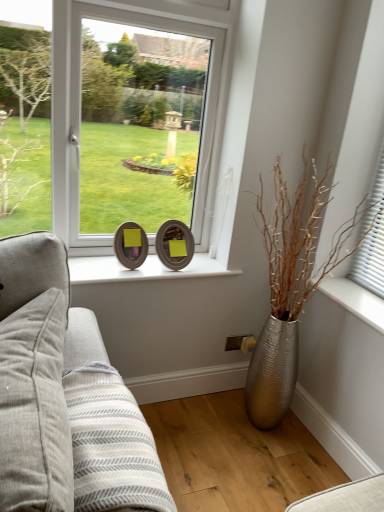
What do you see at coordinates (355, 300) in the screenshot?
I see `silver metallic vase at right` at bounding box center [355, 300].

This screenshot has width=384, height=512. What do you see at coordinates (35, 409) in the screenshot? I see `gray fabric pillow at left` at bounding box center [35, 409].

Describe the element at coordinates (174, 244) in the screenshot. I see `wooden frame at center, which is counted as the first picture frame, starting from the right` at that location.

Where is `silver metallic vase at right`? Image resolution: width=384 pixels, height=512 pixels. silver metallic vase at right is located at coordinates (355, 300).

Is silver metallic vase at right surrounding silver metallic vase at right?

No, silver metallic vase at right is not a part of silver metallic vase at right.

Which object is further away from the camera taking this photo, silver metallic vase at right or silver metallic vase at right?

Positioned behind is silver metallic vase at right.

Which object is positioned more to the left, silver metallic vase at right or silver metallic vase at right?

silver metallic vase at right.

Does point (382, 302) lie behind point (297, 223)?

Yes, it is behind point (297, 223).

From a real-world perspective, is silver metallic vase at right above or below wooden frame at center, which is counted as the first picture frame, starting from the right?

silver metallic vase at right is situated lower than wooden frame at center, which is counted as the first picture frame, starting from the right, in the real world.

From the image's perspective, would you say silver metallic vase at right is positioned over wooden frame at center, which is counted as the first picture frame, starting from the right?

No, from the image's perspective, silver metallic vase at right is not on top of wooden frame at center, which is counted as the first picture frame, starting from the right.

Is silver metallic vase at right bigger or smaller than wooden frame at center, which ranks as the second picture frame in left-to-right order?

silver metallic vase at right is bigger than wooden frame at center, which ranks as the second picture frame in left-to-right order.

Does silver metallic vase at right appear on the right side of silver metallic vase at right?

Incorrect, silver metallic vase at right is not on the right side of silver metallic vase at right.

Is silver metallic vase at right inside silver metallic vase at right?

That's correct, silver metallic vase at right is inside silver metallic vase at right.

From the image's perspective, would you say silver metallic vase at right is positioned over wooden oval frame at center, arranged as the second picture frame when viewed from the right?

No.

From a real-world perspective, is silver metallic vase at right positioned above or below wooden oval frame at center, placed as the 1th picture frame when sorted from left to right?

From a real-world perspective, silver metallic vase at right is physically below wooden oval frame at center, placed as the 1th picture frame when sorted from left to right.

Do you think silver metallic vase at right is within wooden oval frame at center, arranged as the second picture frame when viewed from the right, or outside of it?

silver metallic vase at right lies outside wooden oval frame at center, arranged as the second picture frame when viewed from the right.

Considering the sizes of wooden oval frame at center, placed as the 1th picture frame when sorted from left to right, and silver metallic vase at right in the image, is wooden oval frame at center, placed as the 1th picture frame when sorted from left to right, wider or thinner than silver metallic vase at right?

wooden oval frame at center, placed as the 1th picture frame when sorted from left to right, is thinner than silver metallic vase at right.

Based on the photo, is wooden oval frame at center, placed as the 1th picture frame when sorted from left to right, aimed at silver metallic vase at right?

No, wooden oval frame at center, placed as the 1th picture frame when sorted from left to right, is not turned towards silver metallic vase at right.

Is wooden oval frame at center, placed as the 1th picture frame when sorted from left to right, placed right next to silver metallic vase at right?

No, wooden oval frame at center, placed as the 1th picture frame when sorted from left to right, is not touching silver metallic vase at right.

Find the location of `window sill above the gray fabric pillow at left (from the image's perspective)`. window sill above the gray fabric pillow at left (from the image's perspective) is located at coordinates (355, 300).

Considering the sizes of objects silver metallic vase at right and gray fabric pillow at left in the image provided, who is wider, silver metallic vase at right or gray fabric pillow at left?

silver metallic vase at right is wider.

Considering the relative sizes of silver metallic vase at right and gray fabric pillow at left in the image provided, is silver metallic vase at right bigger than gray fabric pillow at left?

Incorrect, silver metallic vase at right is not larger than gray fabric pillow at left.

Is silver metallic vase at right shorter than gray fabric pillow at left?

Yes.

Measure the distance from wooden oval frame at center, placed as the 1th picture frame when sorted from left to right, to gray fabric pillow at left.

wooden oval frame at center, placed as the 1th picture frame when sorted from left to right, is 32.57 inches away from gray fabric pillow at left.

Does wooden oval frame at center, placed as the 1th picture frame when sorted from left to right, lie in front of gray fabric pillow at left?

No, wooden oval frame at center, placed as the 1th picture frame when sorted from left to right, is further to the viewer.

Consider the image. Can you tell me how much wooden oval frame at center, arranged as the second picture frame when viewed from the right, and gray fabric pillow at left differ in facing direction?

They differ by 103 degrees in their facing directions.

Is wooden oval frame at center, placed as the 1th picture frame when sorted from left to right, smaller than gray fabric pillow at left?

Yes.

Find the location of a particular element. houseplant that appears in front of the silver metallic vase at right is located at coordinates (290, 286).

The image size is (384, 512). Find the location of `houseplant below the wooden frame at center, which is counted as the first picture frame, starting from the right (from the image's perspective)`. houseplant below the wooden frame at center, which is counted as the first picture frame, starting from the right (from the image's perspective) is located at coordinates (290, 286).

From the image, which object appears to be farther from wooden frame at center, which is counted as the first picture frame, starting from the right, silver metallic vase at right or wooden oval frame at center, placed as the 1th picture frame when sorted from left to right?

silver metallic vase at right is positioned further to the anchor wooden frame at center, which is counted as the first picture frame, starting from the right.

When comparing their distances from silver metallic vase at right, does silver metallic vase at right or gray fabric pillow at left seem further?

gray fabric pillow at left is further to silver metallic vase at right.

Based on their spatial positions, is wooden oval frame at center, arranged as the second picture frame when viewed from the right, or silver metallic vase at right closer to silver metallic vase at right?

silver metallic vase at right lies closer to silver metallic vase at right than the other object.

Looking at the image, which one is located closer to wooden oval frame at center, placed as the 1th picture frame when sorted from left to right, gray fabric pillow at left or silver metallic vase at right?

Based on the image, gray fabric pillow at left appears to be nearer to wooden oval frame at center, placed as the 1th picture frame when sorted from left to right.

Looking at the image, which one is located further to wooden frame at center, which ranks as the second picture frame in left-to-right order, silver metallic vase at right or gray fabric pillow at left?

gray fabric pillow at left is further to wooden frame at center, which ranks as the second picture frame in left-to-right order.

Estimate the real-world distances between objects in this image. Which object is closer to wooden oval frame at center, arranged as the second picture frame when viewed from the right, silver metallic vase at right or wooden frame at center, which ranks as the second picture frame in left-to-right order?

Based on the image, wooden frame at center, which ranks as the second picture frame in left-to-right order, appears to be nearer to wooden oval frame at center, arranged as the second picture frame when viewed from the right.

Estimate the real-world distances between objects in this image. Which object is further from wooden oval frame at center, placed as the 1th picture frame when sorted from left to right, silver metallic vase at right or silver metallic vase at right?

Among the two, silver metallic vase at right is located further to wooden oval frame at center, placed as the 1th picture frame when sorted from left to right.

Based on their spatial positions, is wooden frame at center, which is counted as the first picture frame, starting from the right, or gray fabric pillow at left closer to silver metallic vase at right?

Among the two, wooden frame at center, which is counted as the first picture frame, starting from the right, is located nearer to silver metallic vase at right.

Locate an element on the screen. picture frame between gray fabric pillow at left and wooden frame at center, which ranks as the second picture frame in left-to-right order, in the front-back direction is located at coordinates (131, 245).

At what (x,y) coordinates should I click in order to perform the action: click on picture frame situated between wooden oval frame at center, placed as the 1th picture frame when sorted from left to right, and silver metallic vase at right from left to right. Please return your answer as a coordinate pair (x, y). This screenshot has width=384, height=512. Looking at the image, I should click on click(174, 244).

This screenshot has width=384, height=512. In order to click on houseplant between gray fabric pillow at left and silver metallic vase at right in the front-back direction in this screenshot , I will do `click(290, 286)`.

This screenshot has height=512, width=384. Find the location of `houseplant between wooden frame at center, which ranks as the second picture frame in left-to-right order, and silver metallic vase at right from left to right`. houseplant between wooden frame at center, which ranks as the second picture frame in left-to-right order, and silver metallic vase at right from left to right is located at coordinates (290, 286).